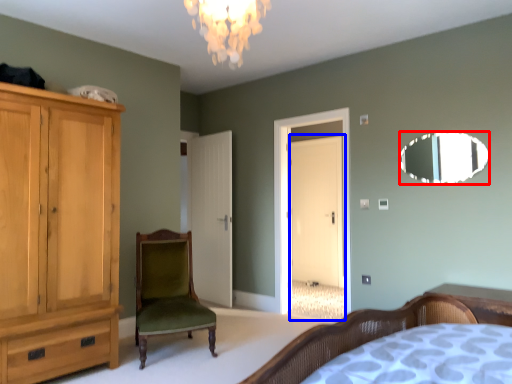
Question: Among these objects, which one is nearest to the camera, mirror (highlighted by a red box) or glass door (highlighted by a blue box)?

Choices:
 (A) mirror
 (B) glass door

Answer: (A)